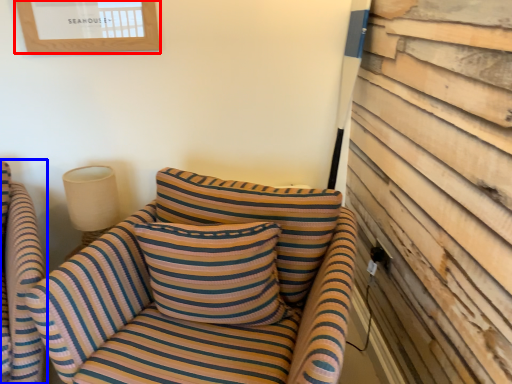
Question: Among these objects, which one is farthest to the camera, picture frame (highlighted by a red box) or chair (highlighted by a blue box)?

Choices:
 (A) picture frame
 (B) chair

Answer: (A)